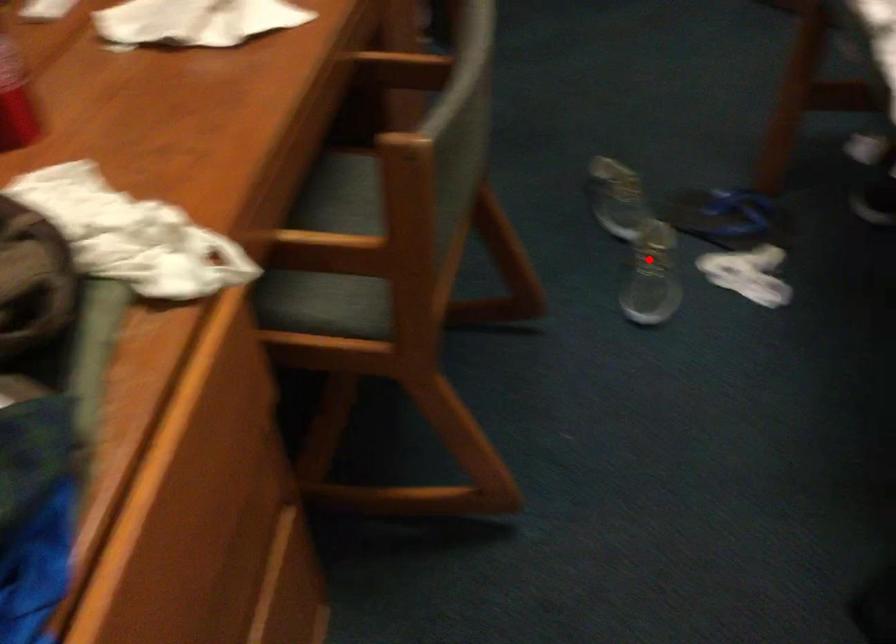
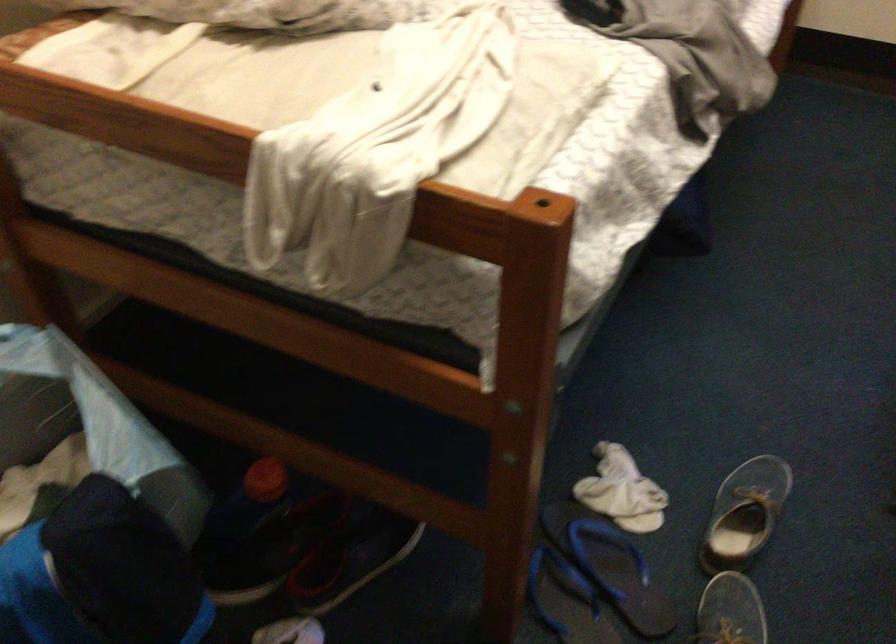
Where in the second image is the point corresponding to the highlighted location from the first image?

(745, 514)